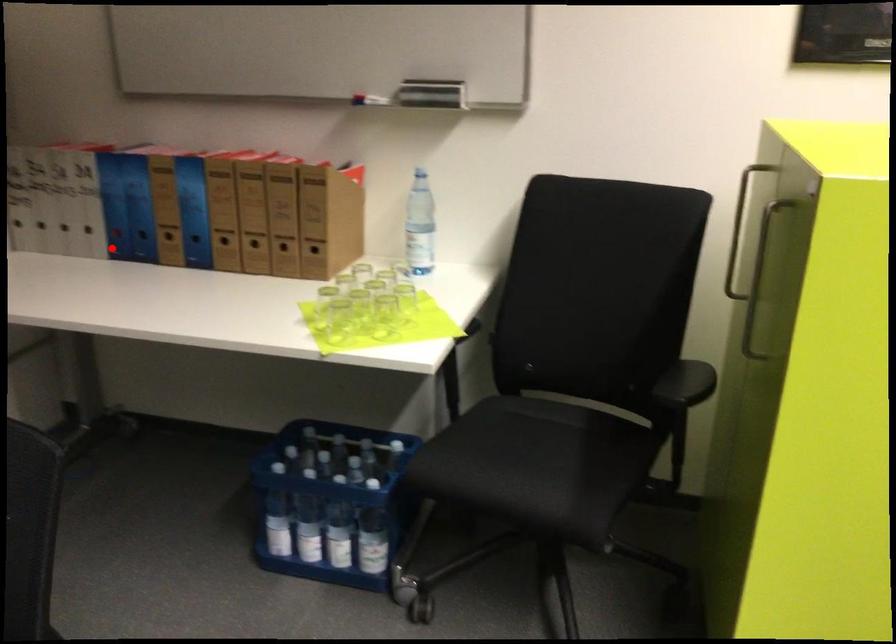
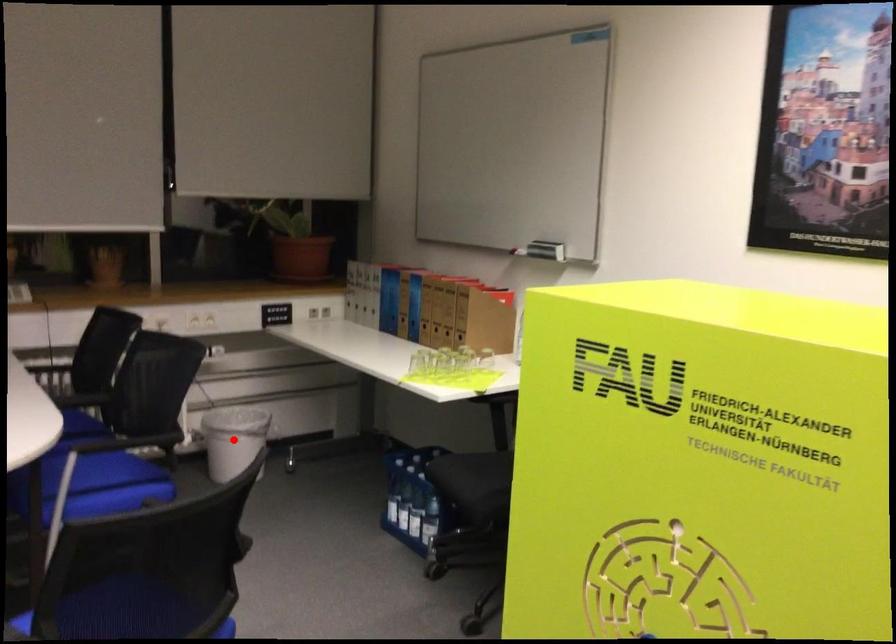
I am providing you with two images of the same scene from different viewpoints. A red point is marked on the first image and another point is marked on the second image. Is the marked point in image1 the same physical position as the marked point in image2?

No